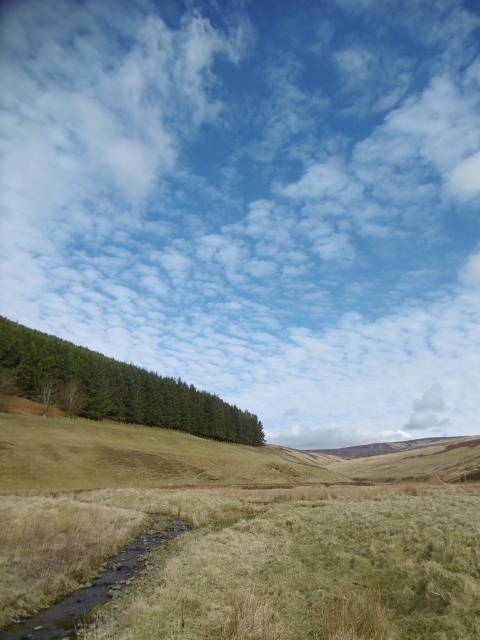
Does point (245, 392) come closer to viewer compared to point (95, 582)?

That is False.

Who is more distant from viewer, [154,138] or [46,637]?

Point [154,138]

Locate an element on the screen. This screenshot has height=640, width=480. white fluffy cloud at upper center is located at coordinates (253, 202).

Does green matte forest at left come behind brown grassy stream at lower left?

Yes.

Which of these two, green matte forest at left or brown grassy stream at lower left, stands shorter?

Standing shorter between the two is brown grassy stream at lower left.

What do you see at coordinates (113, 388) in the screenshot? I see `green matte forest at left` at bounding box center [113, 388].

This screenshot has height=640, width=480. I want to click on green matte forest at left, so click(x=113, y=388).

Does white fluffy cloud at upper center appear on the left side of green matte forest at left?

In fact, white fluffy cloud at upper center is to the right of green matte forest at left.

Who is lower down, white fluffy cloud at upper center or green matte forest at left?

Positioned lower is green matte forest at left.

This screenshot has width=480, height=640. In order to click on white fluffy cloud at upper center in this screenshot , I will do `click(253, 202)`.